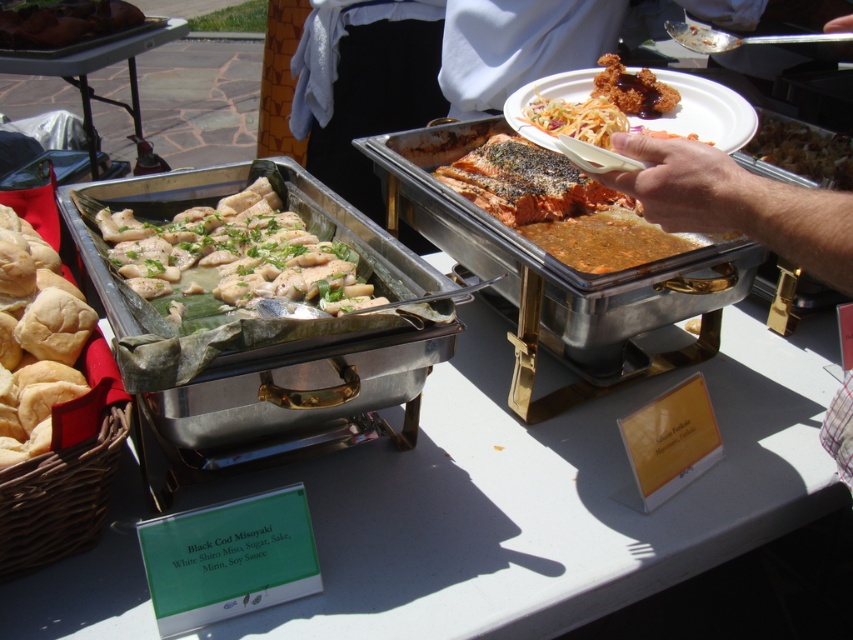
Can you confirm if savory salmon at center is positioned above matte brown bread at left?

No.

Does savory salmon at center appear under matte brown bread at left?

Correct, savory salmon at center is located below matte brown bread at left.

This screenshot has width=853, height=640. What do you see at coordinates (526, 182) in the screenshot?
I see `savory salmon at center` at bounding box center [526, 182].

Find the location of a particular element. savory salmon at center is located at coordinates (526, 182).

Does savory salmon at center have a greater height compared to brushed metal tray at upper left?

No.

Which is behind, point (500, 147) or point (74, 74)?

Positioned behind is point (74, 74).

What do you see at coordinates (526, 182) in the screenshot? This screenshot has width=853, height=640. I see `savory salmon at center` at bounding box center [526, 182].

Find the location of a particular element. savory salmon at center is located at coordinates (526, 182).

Is green leafy garnished fish at center above brown crispy rice at center?

No.

Between green leafy garnished fish at center and brown crispy rice at center, which one has more height?

green leafy garnished fish at center

Who is more distant from viewer, (247,292) or (810,129)?

The point (810,129) is more distant.

At what (x,y) coordinates should I click in order to perform the action: click on green leafy garnished fish at center. Please return your answer as a coordinate pair (x, y). The image size is (853, 640). Looking at the image, I should click on (231, 257).